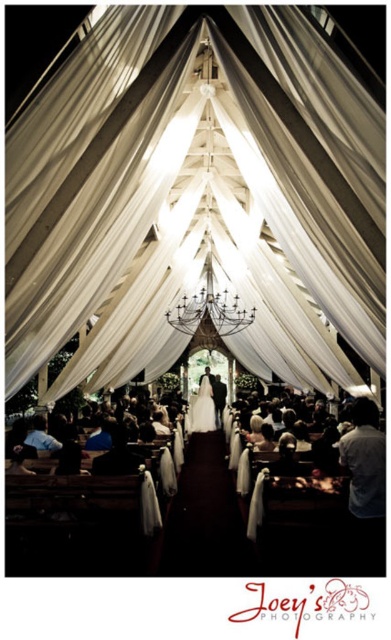
You are a photographer at the wedding. You need to capture a photo of the gray fabric at right and the white satin dress at center. Which object is shorter in height?

A: The gray fabric at right is shorter than the white satin dress at center.

You are a photographer standing at the entrance of the wedding tent. You need to capture a photo that includes both the white satin aisle at center and the black wrought iron chandelier at center. Given that your camera has a maximum focus range of 10 meters, will you be able to fit both objects into a single frame without moving your position?

The distance between the white satin aisle at center and the black wrought iron chandelier at center is 12.42 meters. Since your camera can only focus up to 10 meters, you won t be able to capture both objects in a single frame without moving closer or adjusting your position.

You are a photographer at the wedding ceremony. You want to capture a photo where both the white satin aisle at center and the black wrought iron chandelier at center are visible. However, you notice that one of them is blocking the other. Which object is blocking the other?

The white satin aisle at center is much taller than the black wrought iron chandelier at center, so the white satin aisle at center is blocking the black wrought iron chandelier at center.